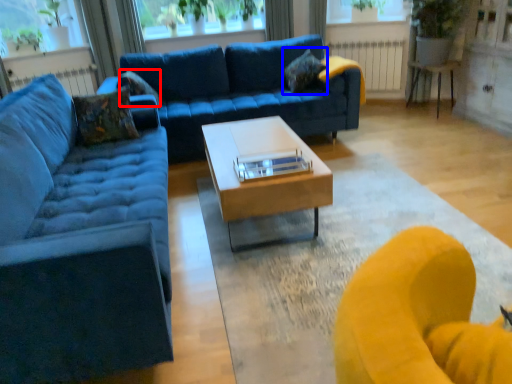
Question: Which of the following is the closest to the observer, pillow (highlighted by a red box) or pillow (highlighted by a blue box)?

Choices:
 (A) pillow
 (B) pillow

Answer: (A)